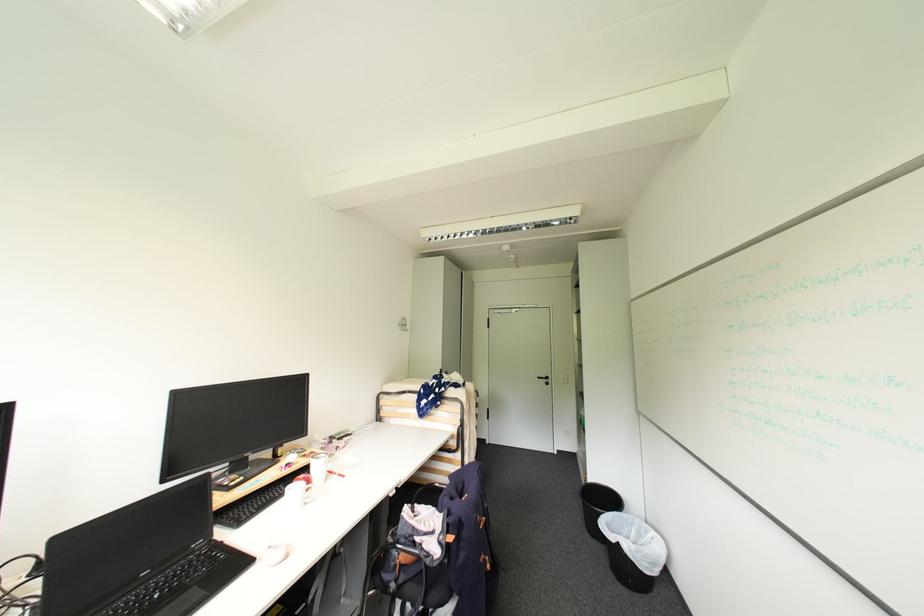
Where would you sit the chair sitting surface? Please return your answer as a coordinate pair (x, y).

(416, 540)